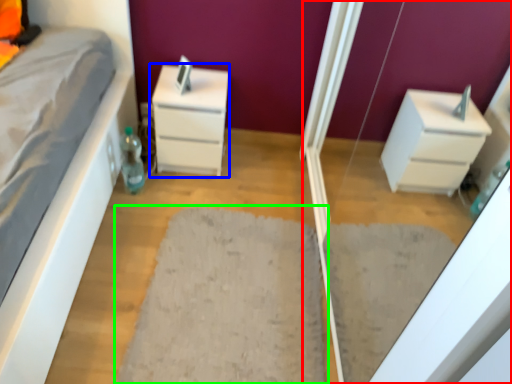
Question: Which object is the closest to the screen door (highlighted by a red box)? Choose among these: chest of drawers (highlighted by a blue box) or doormat (highlighted by a green box).

Choices:
 (A) chest of drawers
 (B) doormat

Answer: (B)